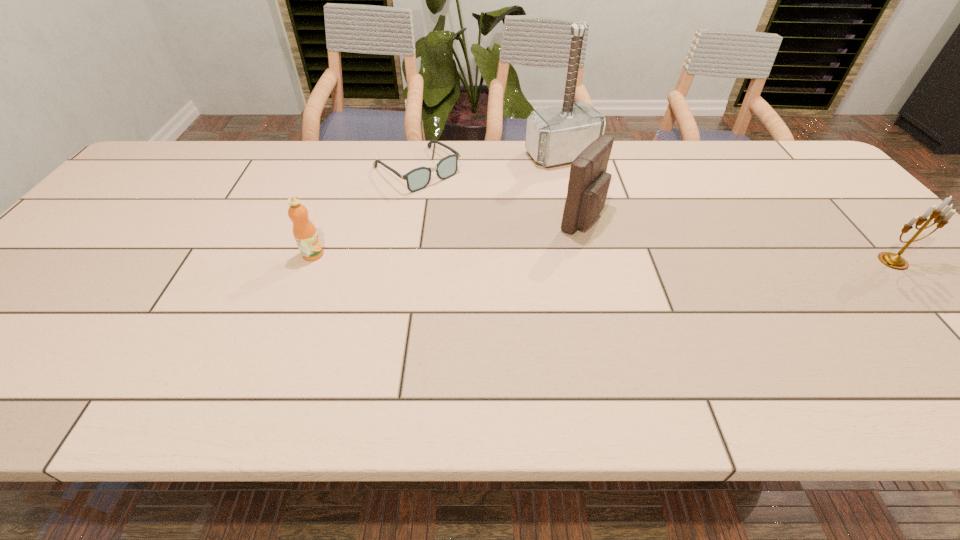
Find the location of a particular element. The width and height of the screenshot is (960, 540). the second shortest object is located at coordinates (304, 231).

You are a GUI agent. You are given a task and a screenshot of the screen. Output one action in this format:
    pyautogui.click(x=<x>, y=<y>)
    Task: Click on the orange juice
    This screenshot has height=540, width=960.
    Given the screenshot: What is the action you would take?
    pyautogui.click(x=304, y=231)

Locate an element on the screen. This screenshot has width=960, height=540. the rightmost object is located at coordinates (895, 261).

Image resolution: width=960 pixels, height=540 pixels. In order to click on pouch in this screenshot , I will do `click(588, 185)`.

Find the location of a particular element. Image resolution: width=960 pixels, height=540 pixels. hammer is located at coordinates (556, 135).

Locate an element on the screen. This screenshot has width=960, height=540. the fourth object from right to left is located at coordinates (418, 178).

Identify the location of spectacles. This screenshot has width=960, height=540. (418, 178).

This screenshot has height=540, width=960. I want to click on vacant space located on the front label of the orange juice, so click(x=444, y=254).

The image size is (960, 540). I want to click on free space located on the left of the candelabrum, so click(752, 261).

Identify the location of vacant space located 0.160m with an open flap on the third nearest object. (662, 252).